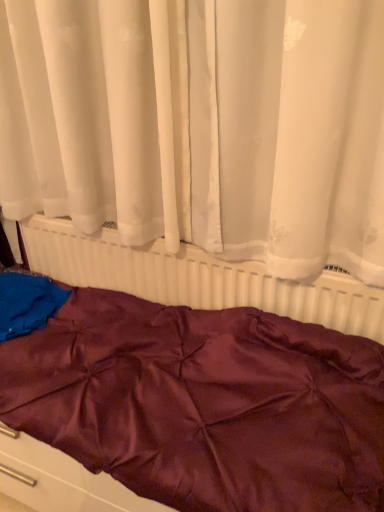
Question: Is white plastic radiator at center positioned beyond the bounds of burgundy satin bedspread at center?

Choices:
 (A) yes
 (B) no

Answer: (A)

Question: Does white plastic radiator at center have a lesser height compared to burgundy satin bedspread at center?

Choices:
 (A) yes
 (B) no

Answer: (B)

Question: Is white plastic radiator at center looking in the opposite direction of burgundy satin bedspread at center?

Choices:
 (A) yes
 (B) no

Answer: (A)

Question: Can you confirm if white plastic radiator at center is thinner than burgundy satin bedspread at center?

Choices:
 (A) no
 (B) yes

Answer: (B)

Question: From the image's perspective, does white plastic radiator at center appear higher than burgundy satin bedspread at center?

Choices:
 (A) yes
 (B) no

Answer: (A)

Question: From a real-world perspective, is white sheer curtain at upper center positioned above or below burgundy satin bedspread at center?

Choices:
 (A) below
 (B) above

Answer: (B)

Question: Does point (283, 90) appear closer or farther from the camera than point (218, 470)?

Choices:
 (A) closer
 (B) farther

Answer: (B)

Question: Is white sheer curtain at upper center situated inside burgundy satin bedspread at center or outside?

Choices:
 (A) outside
 (B) inside

Answer: (A)

Question: From the image's perspective, is white sheer curtain at upper center positioned above or below burgundy satin bedspread at center?

Choices:
 (A) below
 (B) above

Answer: (B)

Question: Is burgundy satin bedspread at center inside the boundaries of white sheer curtain at upper center, or outside?

Choices:
 (A) inside
 (B) outside

Answer: (B)

Question: Relative to white sheer curtain at upper center, is burgundy satin bedspread at center in front or behind?

Choices:
 (A) front
 (B) behind

Answer: (B)

Question: Would you say burgundy satin bedspread at center is to the left or to the right of white sheer curtain at upper center in the picture?

Choices:
 (A) right
 (B) left

Answer: (B)

Question: Is burgundy satin bedspread at center wider or thinner than white sheer curtain at upper center?

Choices:
 (A) wide
 (B) thin

Answer: (A)

Question: Is white plastic radiator at center in front of or behind burgundy satin bedspread at center in the image?

Choices:
 (A) behind
 (B) front

Answer: (A)

Question: From the image's perspective, is white plastic radiator at center located above or below burgundy satin bedspread at center?

Choices:
 (A) below
 (B) above

Answer: (B)